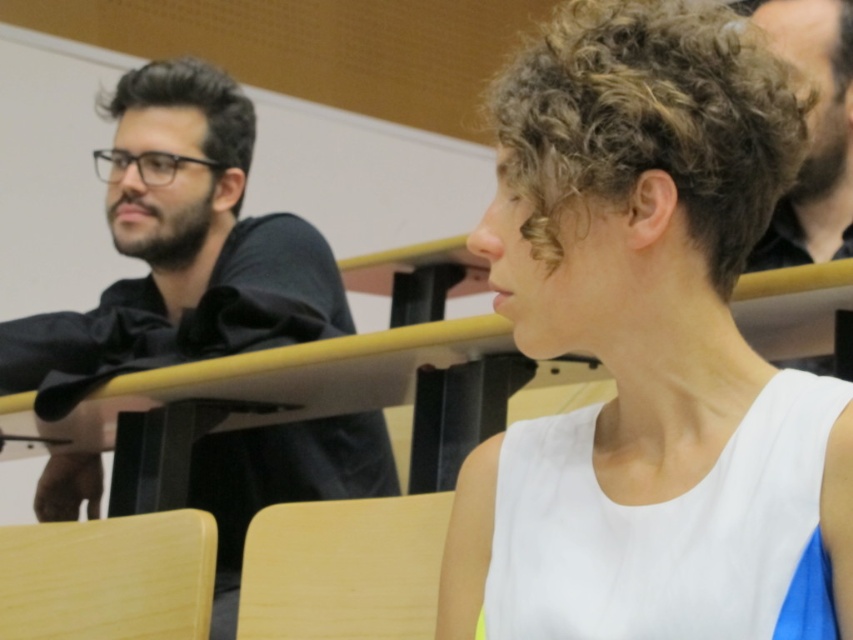
Is black matte shirt at left further to camera compared to dark brown curly hair at upper right?

No.

Which of these two, black matte shirt at left or dark brown curly hair at upper right, stands shorter?

dark brown curly hair at upper right is shorter.

Between point (231, 346) and point (813, 128), which one is positioned in front?

Positioned in front is point (813, 128).

Find the location of a particular element. black matte shirt at left is located at coordinates (178, 248).

Is white matte tank top at center bigger than black matte shirt at left?

Incorrect, white matte tank top at center is not larger than black matte shirt at left.

Who is more forward, [711,202] or [216,316]?

Point [711,202] is in front.

Find the location of a particular element. This screenshot has height=640, width=853. white matte tank top at center is located at coordinates (643, 342).

Is point (573, 324) less distant than point (842, 96)?

That is True.

Where is `white matte tank top at center`? The height and width of the screenshot is (640, 853). white matte tank top at center is located at coordinates (643, 342).